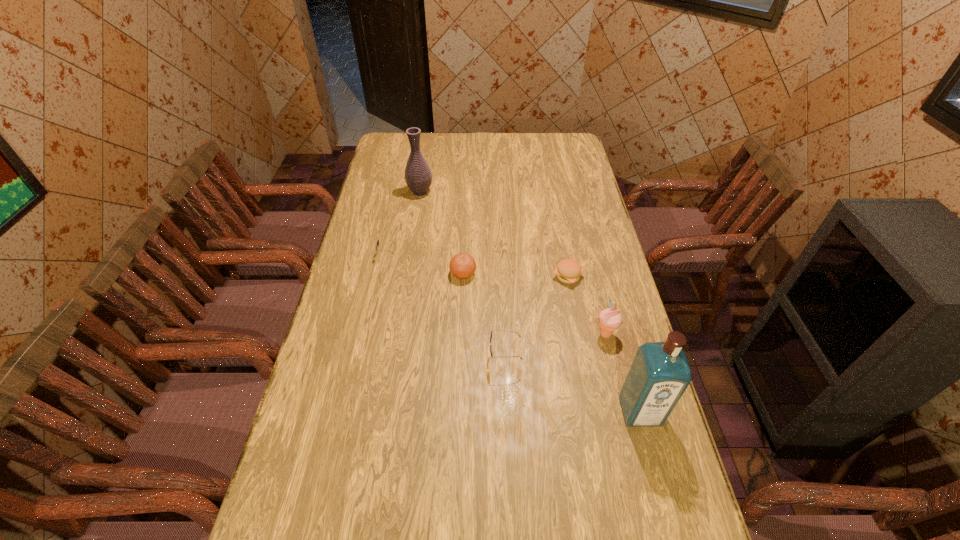
Identify the location of the third closest object relative to the clementine. The height and width of the screenshot is (540, 960). (568, 271).

The height and width of the screenshot is (540, 960). I want to click on free space that satisfies the following two spatial constraints: 1. in front of the lenses of the fifth shortest object; 2. on the left side of the shorter sunglasses, so click(x=370, y=335).

Find the location of a particular element. This screenshot has width=960, height=540. vacant area in the image that satisfies the following two spatial constraints: 1. in front of the lenses of the fifth object from right to left; 2. on the right side of the farther sunglasses is located at coordinates (383, 274).

You are a GUI agent. You are given a task and a screenshot of the screen. Output one action in this format:
    pyautogui.click(x=<x>, y=<y>)
    Task: Click on the blank area in the image that satisfies the following two spatial constraints: 1. in front of the lenses of the clementine; 2. on the left side of the shorter sunglasses
    The image size is (960, 540).
    Given the screenshot: What is the action you would take?
    pyautogui.click(x=383, y=274)

The image size is (960, 540). Identify the location of free spot that satisfies the following two spatial constraints: 1. on the front side of the clementine; 2. on the left side of the vase. (407, 274).